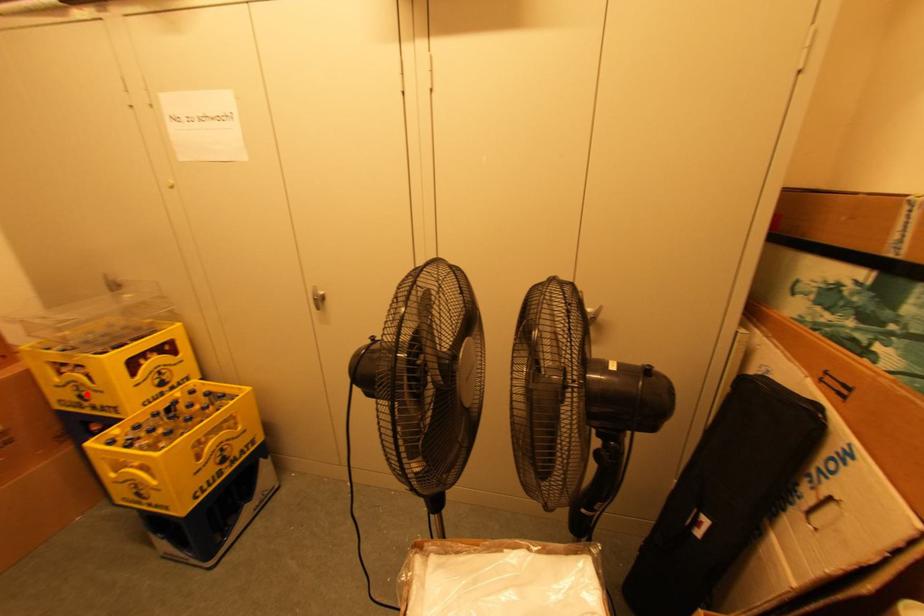
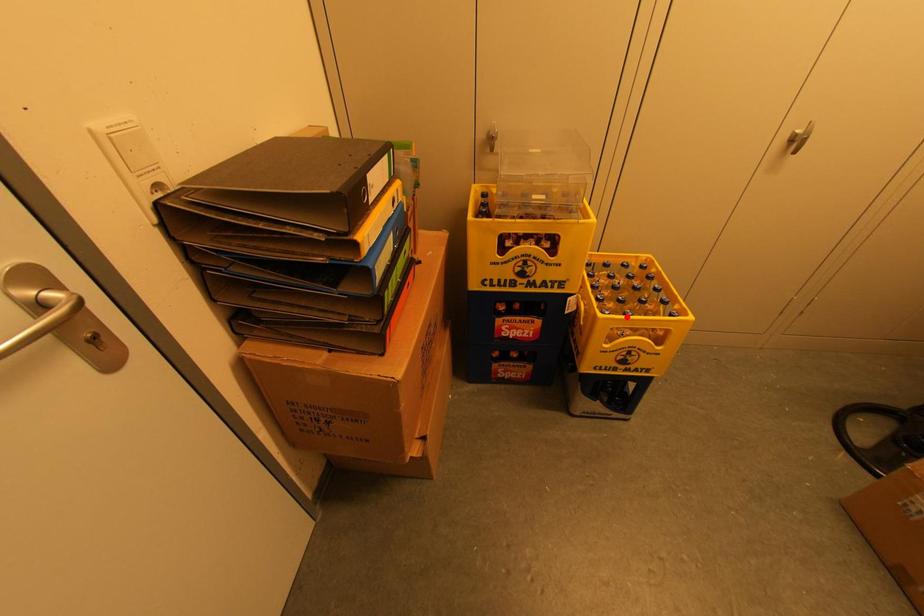
Looking at this image, I am providing you with two images of the same scene from different viewpoints. A red point is marked on the first image and another point is marked on the second image. Is the red point in image1 aligned with the point shown in image2?

No